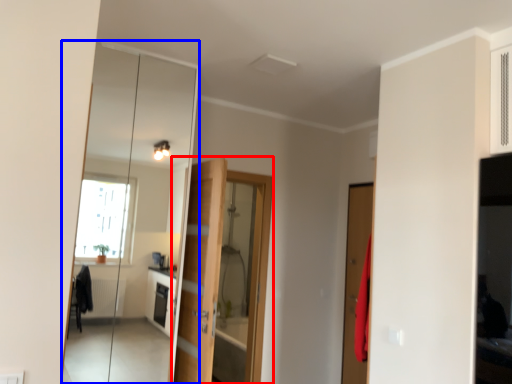
Question: Among these objects, which one is farthest to the camera, door (highlighted by a red box) or mirror (highlighted by a blue box)?

Choices:
 (A) door
 (B) mirror

Answer: (A)